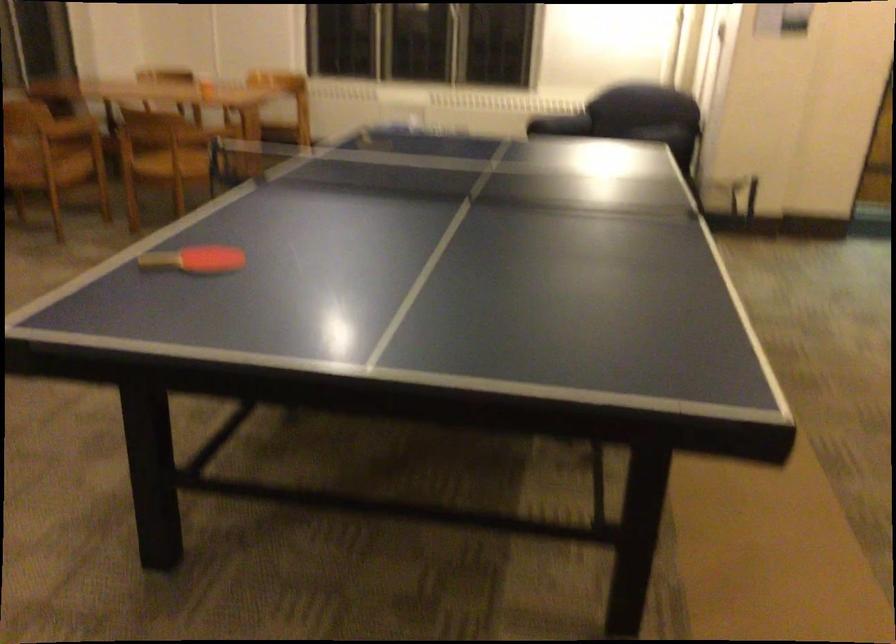
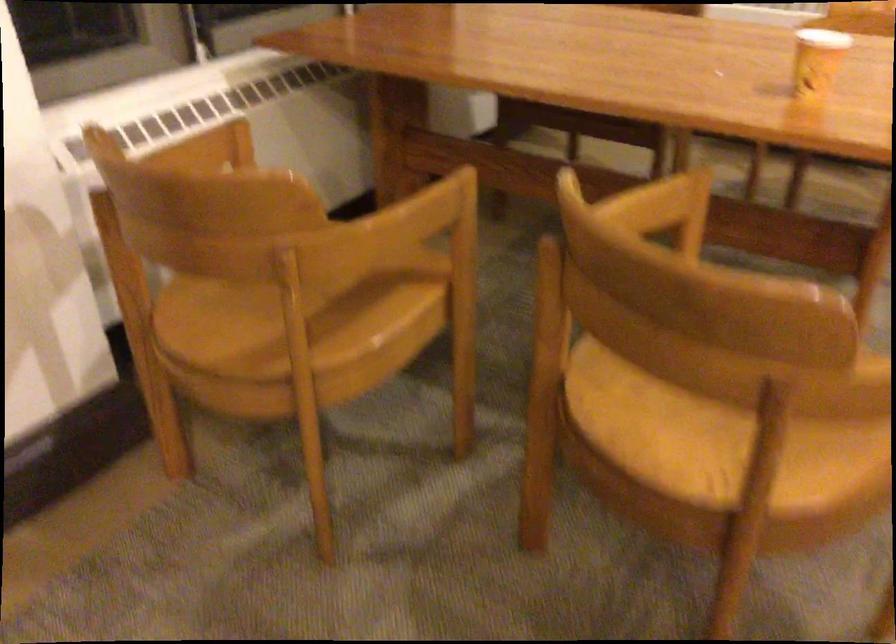
Where in the second image is the point corresponding to (211,91) from the first image?

(816, 61)